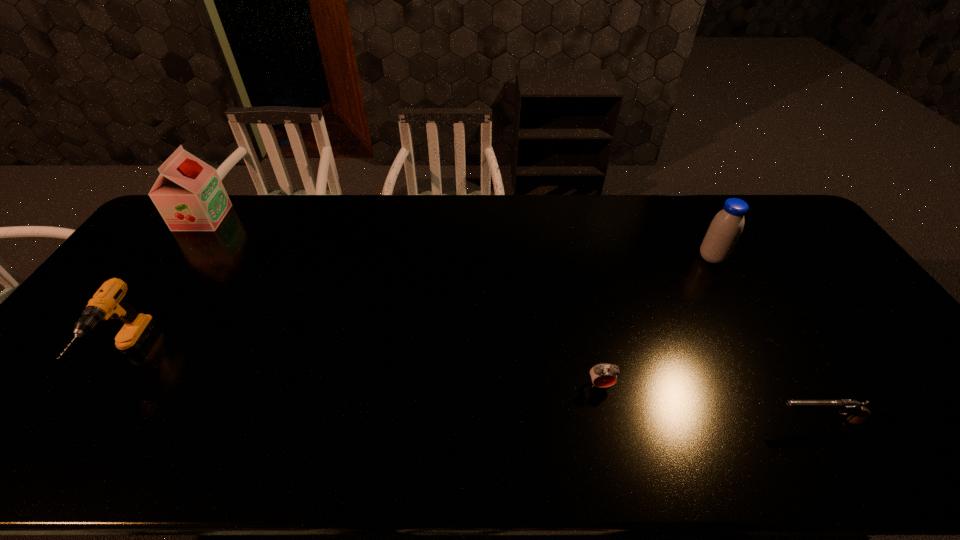
Where is `free space at the right edge of the desktop`? free space at the right edge of the desktop is located at coordinates (899, 381).

In the image, there is a desktop. Where is `free space at the far left corner`? This screenshot has height=540, width=960. free space at the far left corner is located at coordinates (228, 194).

This screenshot has height=540, width=960. Find the location of `empty space between the gun and the shorter soya milk`. empty space between the gun and the shorter soya milk is located at coordinates 764,340.

Find the location of `vacant area that lies between the drill and the alarm clock`. vacant area that lies between the drill and the alarm clock is located at coordinates (365, 370).

At what (x,y) coordinates should I click in order to perform the action: click on vacant area that lies between the alarm clock and the nearest object. Please return your answer as a coordinate pair (x, y). The width and height of the screenshot is (960, 540). Looking at the image, I should click on coord(708,403).

In order to click on free space between the gun and the fourth nearest object in this screenshot , I will do `click(764, 340)`.

Image resolution: width=960 pixels, height=540 pixels. I want to click on empty space between the farthest object and the drill, so click(165, 287).

Image resolution: width=960 pixels, height=540 pixels. Find the location of `free space between the fourth nearest object and the drill`. free space between the fourth nearest object and the drill is located at coordinates (420, 307).

Image resolution: width=960 pixels, height=540 pixels. What are the coordinates of `vacant area that lies between the nearer soya milk and the farthest object` in the screenshot? It's located at (457, 238).

Image resolution: width=960 pixels, height=540 pixels. Find the location of `vacant area that lies between the drill and the farther soya milk`. vacant area that lies between the drill and the farther soya milk is located at coordinates (165, 287).